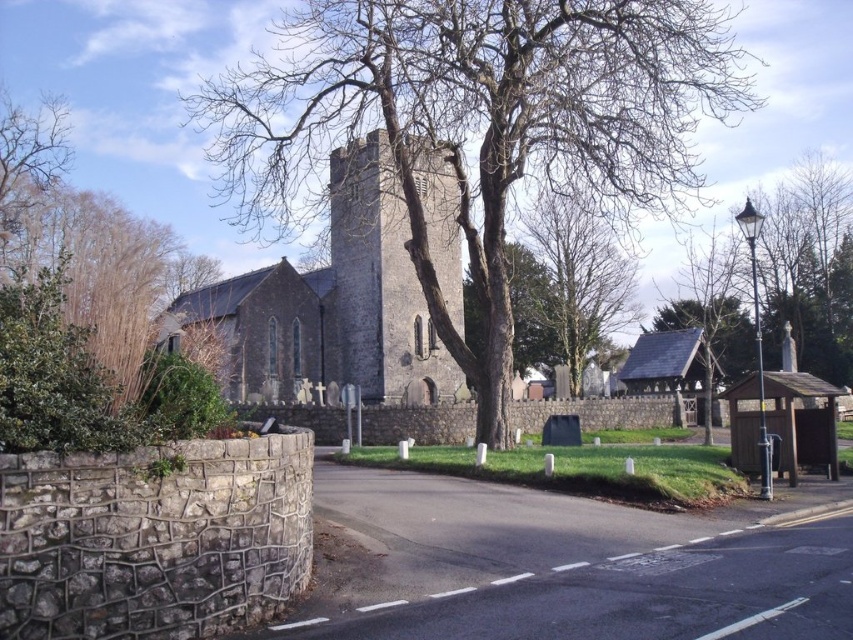
Question: Where is bare branches at center located in relation to gray stone tower at center in the image?

Choices:
 (A) left
 (B) right

Answer: (B)

Question: Which of these objects is positioned farthest from the green leafy shrub at left?

Choices:
 (A) bare branches at center
 (B) bare wood tree at center
 (C) gray stone tower at center

Answer: (B)

Question: Can you confirm if green leafy shrub at left is positioned to the right of bare wood tree at center?

Choices:
 (A) no
 (B) yes

Answer: (A)

Question: Is bare branches at center closer to the viewer compared to gray stone tower at center?

Choices:
 (A) no
 (B) yes

Answer: (B)

Question: Which point appears closest to the camera in this image?

Choices:
 (A) (635, 67)
 (B) (28, 113)
 (C) (355, 172)
 (D) (554, 253)

Answer: (A)

Question: Which of the following is the farthest from the observer?

Choices:
 (A) (445, 195)
 (B) (418, 35)
 (C) (561, 240)

Answer: (C)